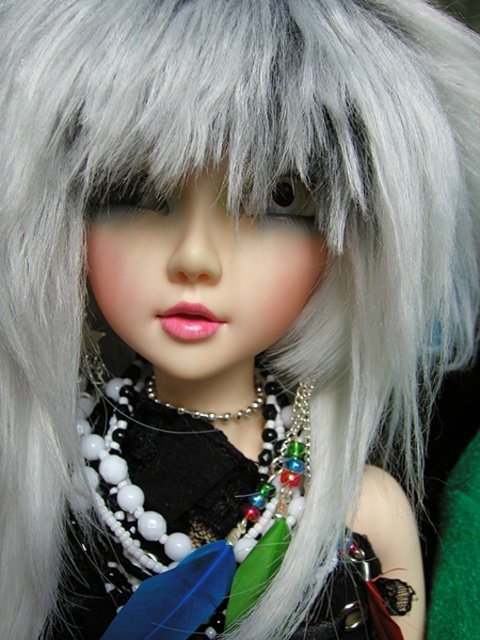
Question: Is multicolored beaded necklace at center wider than pearl beaded necklace at center?

Choices:
 (A) no
 (B) yes

Answer: (B)

Question: Is multicolored beaded necklace at center behind pearl beaded necklace at center?

Choices:
 (A) no
 (B) yes

Answer: (A)

Question: Which object is closer to the camera taking this photo?

Choices:
 (A) multicolored beaded necklace at center
 (B) pearl beaded necklace at center

Answer: (A)

Question: Considering the relative positions of multicolored beaded necklace at center and pearl beaded necklace at center in the image provided, where is multicolored beaded necklace at center located with respect to pearl beaded necklace at center?

Choices:
 (A) above
 (B) below

Answer: (B)